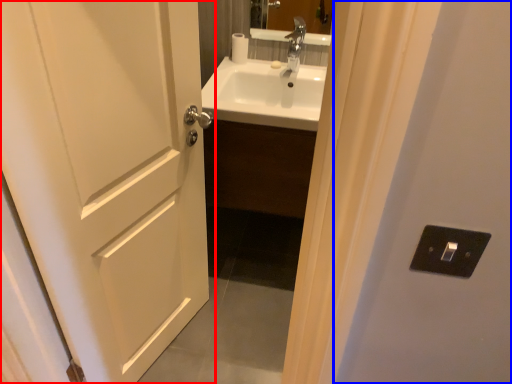
Question: Among these objects, which one is farthest to the camera, door (highlighted by a red box) or screen door (highlighted by a blue box)?

Choices:
 (A) door
 (B) screen door

Answer: (A)